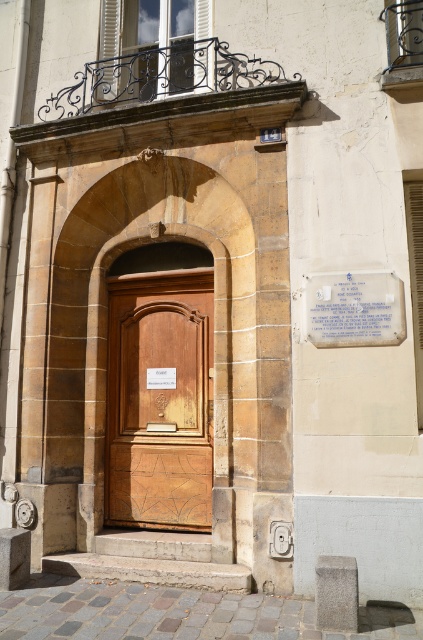
You are a visitor approaching the entrance and want to read the text on the white paper plaque at upper right. Which direction should you move relative to the wooden carved door at center to reach the plaque?

The wooden carved door at center is positioned on the left side of the white paper plaque at upper right, so you should move to the right of the wooden carved door at center to reach the plaque.

You are standing at the entrance of the building and want to locate two specific points marked on the door and archway. The first point is at coordinate point (172, 416) and the second is at coordinate point (348, 340). Which point is closer to you as you face the entrance?

Point (348, 340) is closer to you because it is in front of point (172, 416).

You are a painter who wants to hang a new sign on the building entrance. The sign you have is exactly the same width as the white paper plaque at upper right. If you want to place your new sign to the left of the wooden carved door at center, will there be enough space for it without overlapping?

The wooden carved door at center is wider than the white paper plaque at upper right. Since your sign has the same width as the plaque, there should be enough space to place it to the left of the door without overlapping, as the door is wider and provides sufficient clearance.